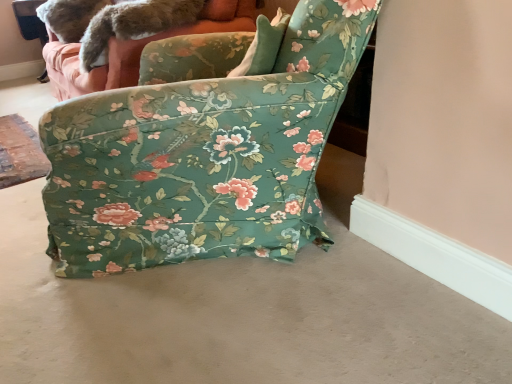
Question: Is floral fabric couch at upper center smaller than fuzzy fur tail at upper left?

Choices:
 (A) no
 (B) yes

Answer: (A)

Question: Is floral fabric couch at upper center positioned with its back to fuzzy fur tail at upper left?

Choices:
 (A) yes
 (B) no

Answer: (B)

Question: From the image's perspective, is floral fabric couch at upper center over fuzzy fur tail at upper left?

Choices:
 (A) no
 (B) yes

Answer: (B)

Question: Is floral fabric couch at upper center far away from fuzzy fur tail at upper left?

Choices:
 (A) yes
 (B) no

Answer: (B)

Question: Is floral fabric couch at upper center to the left of fuzzy fur tail at upper left from the viewer's perspective?

Choices:
 (A) no
 (B) yes

Answer: (B)

Question: Choose the correct answer: Is fuzzy fur tail at upper left inside floral fabric chair at center or outside it?

Choices:
 (A) outside
 (B) inside

Answer: (A)

Question: Visually, is fuzzy fur tail at upper left positioned to the left or to the right of floral fabric chair at center?

Choices:
 (A) left
 (B) right

Answer: (A)

Question: Relative to floral fabric chair at center, is fuzzy fur tail at upper left in front or behind?

Choices:
 (A) behind
 (B) front

Answer: (A)

Question: In terms of size, does fuzzy fur tail at upper left appear bigger or smaller than floral fabric chair at center?

Choices:
 (A) big
 (B) small

Answer: (B)

Question: Considering the positions of beige carpet at lower center and floral fabric chair at center in the image, is beige carpet at lower center taller or shorter than floral fabric chair at center?

Choices:
 (A) tall
 (B) short

Answer: (B)

Question: From the image's perspective, is beige carpet at lower center positioned above or below floral fabric chair at center?

Choices:
 (A) above
 (B) below

Answer: (B)

Question: In terms of width, does beige carpet at lower center look wider or thinner when compared to floral fabric chair at center?

Choices:
 (A) thin
 (B) wide

Answer: (A)

Question: Considering the relative positions of beige carpet at lower center and floral fabric chair at center in the image provided, is beige carpet at lower center to the left or to the right of floral fabric chair at center?

Choices:
 (A) left
 (B) right

Answer: (B)

Question: From the image's perspective, relative to fuzzy fur tail at upper left, is floral fabric couch at upper center above or below?

Choices:
 (A) above
 (B) below

Answer: (A)

Question: Is point (65, 64) positioned closer to the camera than point (52, 26)?

Choices:
 (A) farther
 (B) closer

Answer: (B)